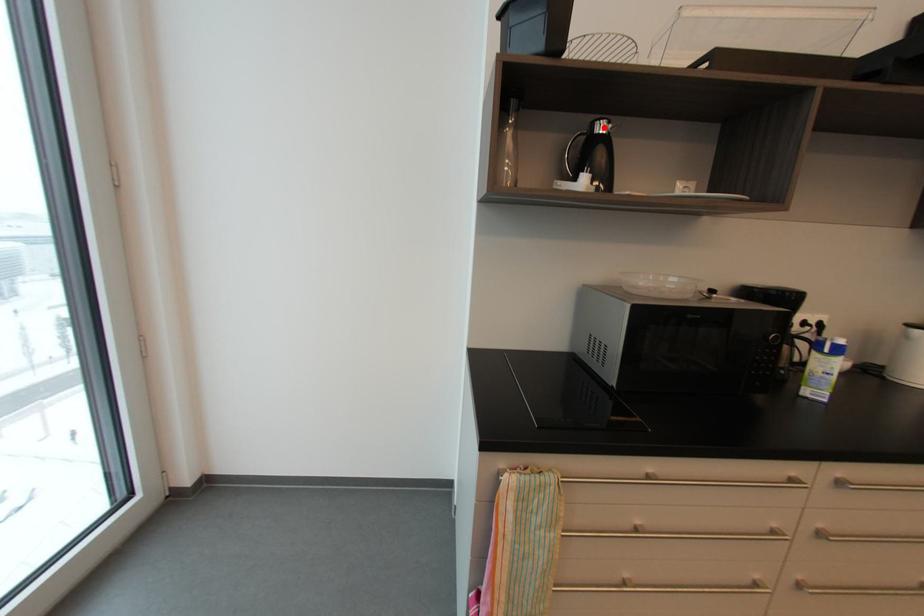
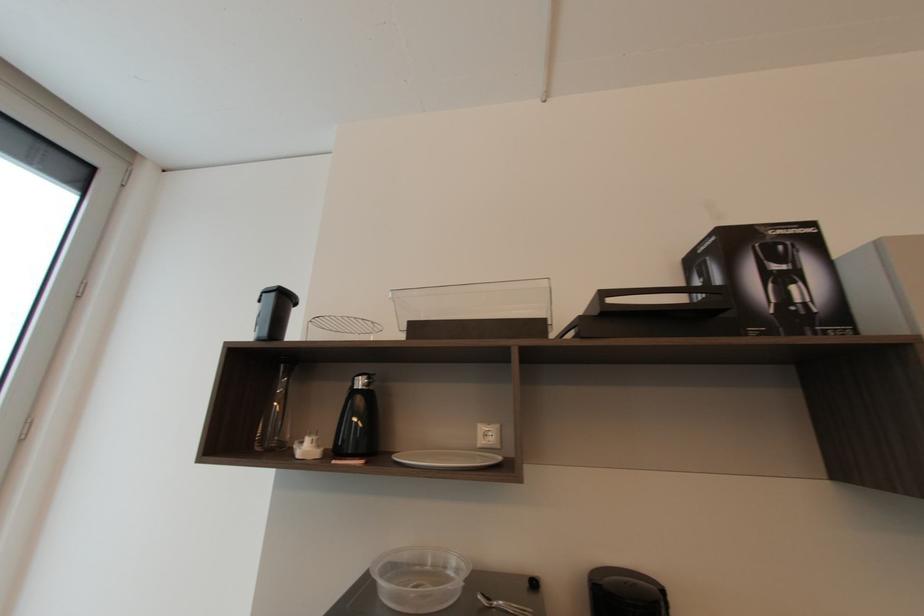
Where in the second image is the point corresponding to the highlighted location from the first image?

(362, 384)